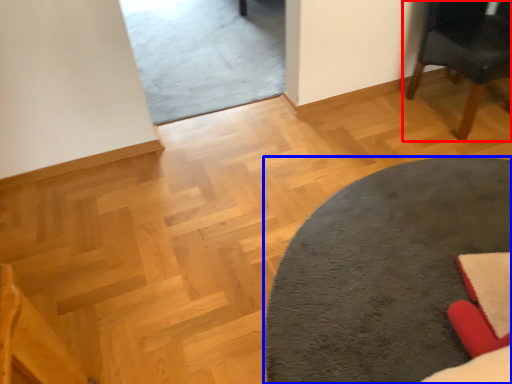
Question: Which of the following is the closest to the observer, chair (highlighted by a red box) or table (highlighted by a blue box)?

Choices:
 (A) chair
 (B) table

Answer: (B)